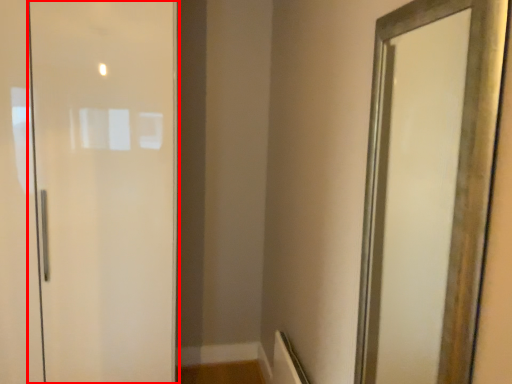
Question: Where is door (annotated by the red box) located in relation to mirror in the image?

Choices:
 (A) right
 (B) left

Answer: (B)